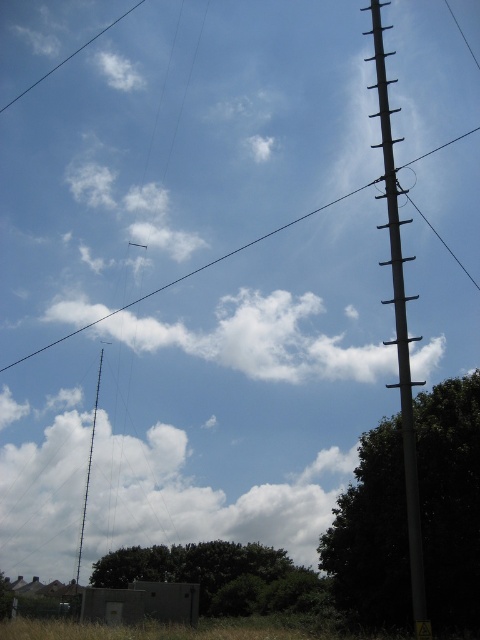
Is green leafy tree at right positioned before smooth gray pole at right?

No, it is not.

Is point (381, 531) farther from camera compared to point (414, 296)?

Yes, point (381, 531) is behind point (414, 296).

The width and height of the screenshot is (480, 640). Identify the location of green leafy tree at right. (450, 499).

Which is more to the left, green leafy tree at lower center or smooth gray pole at right?

From the viewer's perspective, green leafy tree at lower center appears more on the left side.

Does point (160, 568) come in front of point (379, 88)?

No, (160, 568) is further to viewer.

Identify the location of green leafy tree at lower center. The image size is (480, 640). (219, 576).

Does green leafy tree at lower center appear under white wire at upper left?

Correct, green leafy tree at lower center is located below white wire at upper left.

Which is more to the right, green leafy tree at lower center or white wire at upper left?

green leafy tree at lower center is more to the right.

You are a GUI agent. You are given a task and a screenshot of the screen. Output one action in this format:
    pyautogui.click(x=<x>, y=<y>)
    Task: Click on the green leafy tree at lower center
    
    Given the screenshot: What is the action you would take?
    pyautogui.click(x=219, y=576)